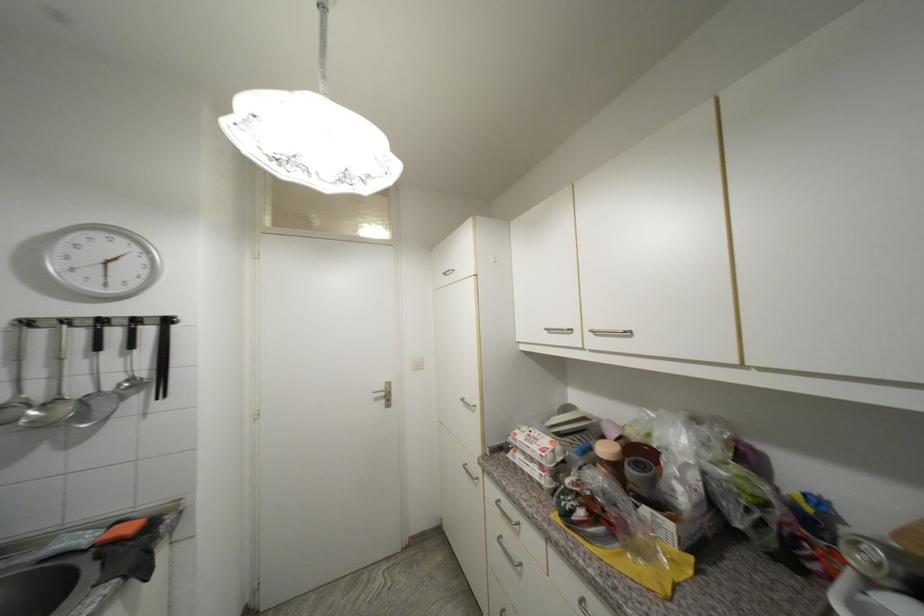
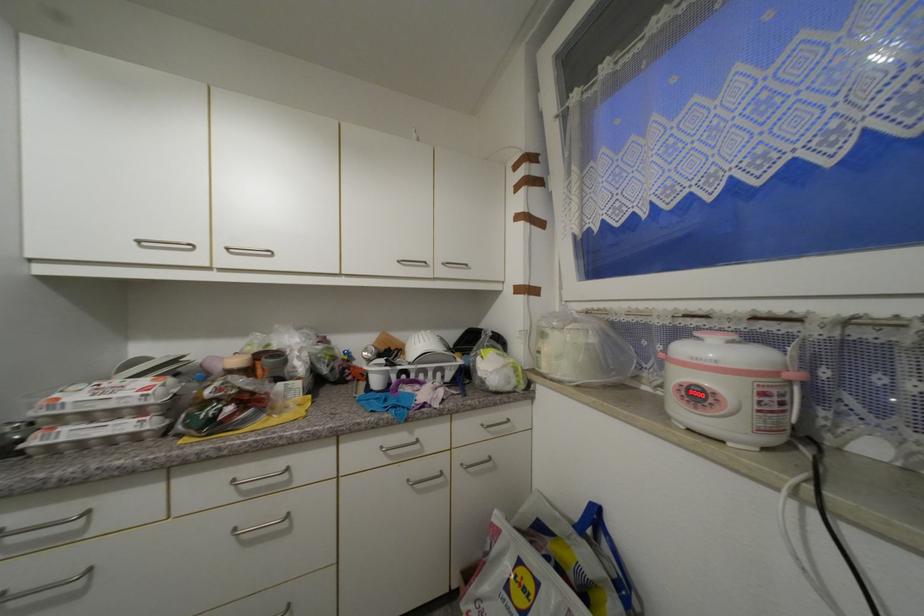
Question: Based on the continuous images, in which direction is the camera rotating? Reply with the corresponding letter.

Choices:
 (A) Left
 (B) Right
 (C) Up
 (D) Down

Answer: (B)